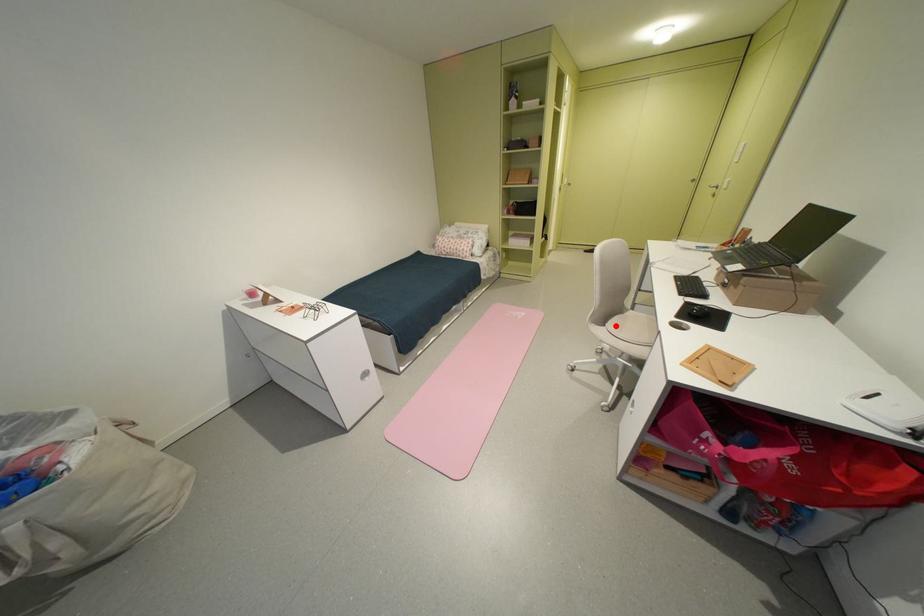
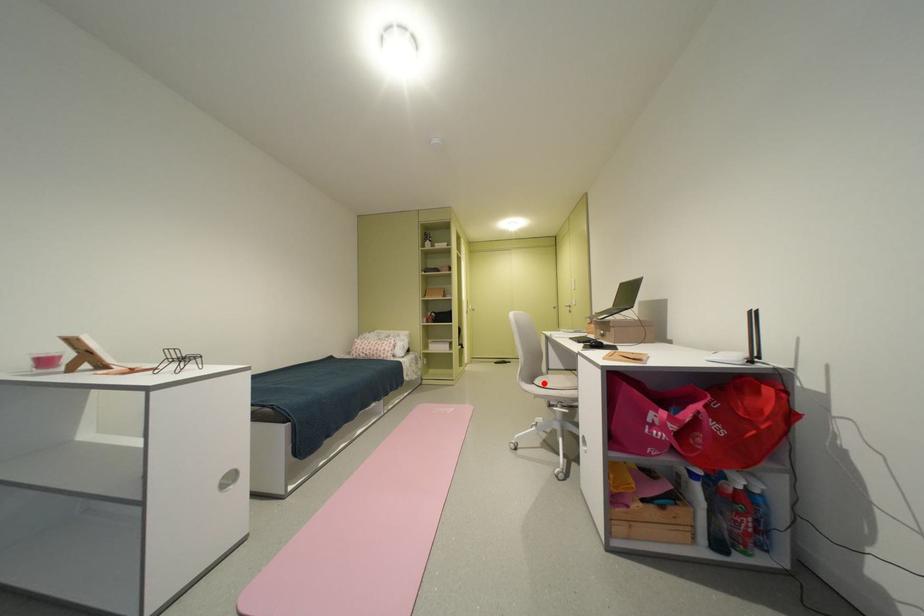
I am providing you with two images of the same scene from different viewpoints. A red point is marked on the first image and another point is marked on the second image. Is the red point in image1 aligned with the point shown in image2?

Yes